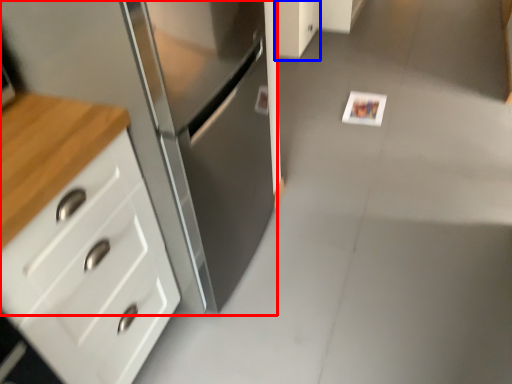
Question: Which object is closer to the camera taking this photo, cabinetry (highlighted by a red box) or cabinetry (highlighted by a blue box)?

Choices:
 (A) cabinetry
 (B) cabinetry

Answer: (A)